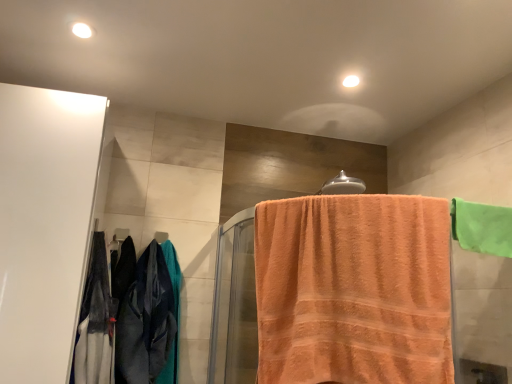
Question: Is white glossy cabinet at left closer to the viewer compared to orange terry cloth towel at center, the 1th towel positioned from the left?

Choices:
 (A) yes
 (B) no

Answer: (B)

Question: Is the depth of white glossy cabinet at left greater than that of orange terry cloth towel at center, the 1th towel positioned from the left?

Choices:
 (A) no
 (B) yes

Answer: (B)

Question: From the image's perspective, is white glossy cabinet at left below orange terry cloth towel at center, the 1th towel positioned from the left?

Choices:
 (A) no
 (B) yes

Answer: (A)

Question: Is white glossy cabinet at left to the right of orange terry cloth towel at center, the 1th towel positioned from the left, from the viewer's perspective?

Choices:
 (A) no
 (B) yes

Answer: (A)

Question: Can you confirm if white glossy cabinet at left is bigger than orange terry cloth towel at center, which is counted as the 2th towel, starting from the right?

Choices:
 (A) no
 (B) yes

Answer: (B)

Question: Can you confirm if white glossy cabinet at left is taller than orange terry cloth towel at center, the 1th towel positioned from the left?

Choices:
 (A) yes
 (B) no

Answer: (A)

Question: Is velvet-like dark blue pants at left placed right next to silver metallic towel bar at upper center, positioned as the 1th towel bar in front-to-back order?

Choices:
 (A) yes
 (B) no

Answer: (B)

Question: Is velvet-like dark blue pants at left thinner than silver metallic towel bar at upper center, marked as the 2th towel bar in a bottom-to-top arrangement?

Choices:
 (A) no
 (B) yes

Answer: (A)

Question: Considering the relative positions of velvet-like dark blue pants at left and silver metallic towel bar at upper center, the second towel bar viewed from the back, in the image provided, is velvet-like dark blue pants at left behind silver metallic towel bar at upper center, the second towel bar viewed from the back,?

Choices:
 (A) no
 (B) yes

Answer: (B)

Question: Is velvet-like dark blue pants at left far from silver metallic towel bar at upper center, the second towel bar viewed from the back?

Choices:
 (A) yes
 (B) no

Answer: (B)

Question: Is velvet-like dark blue pants at left positioned with its back to silver metallic towel bar at upper center, positioned as the 1th towel bar in front-to-back order?

Choices:
 (A) yes
 (B) no

Answer: (B)

Question: From a real-world perspective, is velvet-like dark blue pants at left below silver metallic towel bar at upper center, positioned as the 1th towel bar in front-to-back order?

Choices:
 (A) yes
 (B) no

Answer: (A)

Question: Would you say velvet-like dark blue pants at left is outside green fabric towel at upper right, which is counted as the first towel, starting from the right?

Choices:
 (A) yes
 (B) no

Answer: (A)